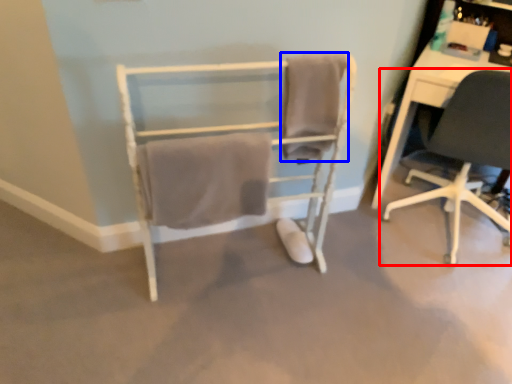
Question: Among these objects, which one is farthest to the camera, chair (highlighted by a red box) or bath towel (highlighted by a blue box)?

Choices:
 (A) chair
 (B) bath towel

Answer: (A)